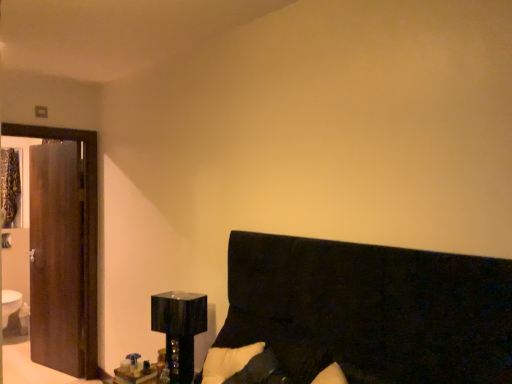
Question: Would you say dark wood door at left contains black fabric headboard at lower right?

Choices:
 (A) no
 (B) yes

Answer: (A)

Question: Is the surface of dark wood door at left in direct contact with black fabric headboard at lower right?

Choices:
 (A) yes
 (B) no

Answer: (B)

Question: Considering the relative sizes of dark wood door at left and black fabric headboard at lower right in the image provided, is dark wood door at left thinner than black fabric headboard at lower right?

Choices:
 (A) yes
 (B) no

Answer: (A)

Question: Can you confirm if dark wood door at left is positioned to the left of black fabric headboard at lower right?

Choices:
 (A) no
 (B) yes

Answer: (B)

Question: Is dark wood door at left to the right of black fabric headboard at lower right from the viewer's perspective?

Choices:
 (A) no
 (B) yes

Answer: (A)

Question: Looking at the image, does dark wood door at left seem bigger or smaller compared to wooden glossy table at lower left?

Choices:
 (A) small
 (B) big

Answer: (B)

Question: Choose the correct answer: Is dark wood door at left inside wooden glossy table at lower left or outside it?

Choices:
 (A) inside
 (B) outside

Answer: (B)

Question: Considering the positions of dark wood door at left and wooden glossy table at lower left in the image, is dark wood door at left wider or thinner than wooden glossy table at lower left?

Choices:
 (A) thin
 (B) wide

Answer: (A)

Question: In the image, is dark wood door at left on the left side or the right side of wooden glossy table at lower left?

Choices:
 (A) left
 (B) right

Answer: (A)

Question: From the image's perspective, relative to glossy black cube at lower left, is dark wood door at left above or below?

Choices:
 (A) below
 (B) above

Answer: (B)

Question: Is dark wood door at left wider or thinner than glossy black cube at lower left?

Choices:
 (A) wide
 (B) thin

Answer: (B)

Question: Visually, is dark wood door at left positioned to the left or to the right of glossy black cube at lower left?

Choices:
 (A) left
 (B) right

Answer: (A)

Question: Considering the positions of dark wood door at left and glossy black cube at lower left in the image, is dark wood door at left bigger or smaller than glossy black cube at lower left?

Choices:
 (A) big
 (B) small

Answer: (A)

Question: Considering their positions, is dark wood door at left located in front of or behind black fabric headboard at lower right?

Choices:
 (A) behind
 (B) front

Answer: (A)

Question: Based on their sizes in the image, would you say dark wood door at left is bigger or smaller than black fabric headboard at lower right?

Choices:
 (A) small
 (B) big

Answer: (A)